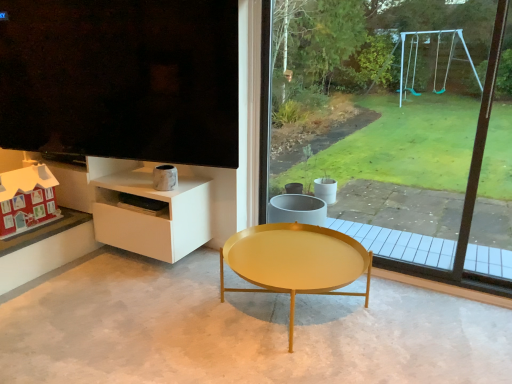
I want to click on free space that is in between white glossy shelf at lower left and gold metallic coffee table at center, so click(x=180, y=277).